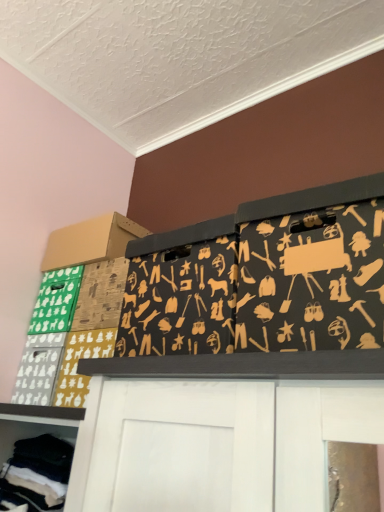
Question: Should I look upward or downward to see black fabric with tool patterns at upper center?

Choices:
 (A) up
 (B) down

Answer: (B)